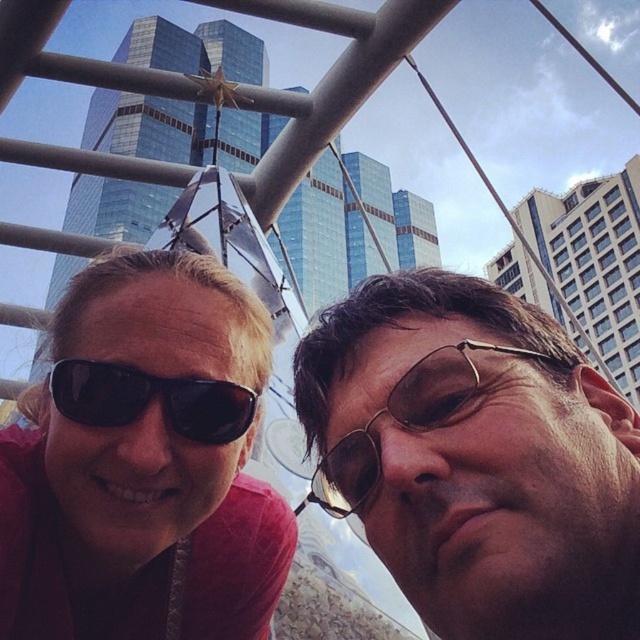
You are a photographer trying to capture a closeup shot of the metallic sunglasses at center and the black matte sunglasses at left. Which pair has a smaller width that might require you to adjust your camera focus for detail?

The metallic sunglasses at center has a lesser width compared to the black matte sunglasses at left, so it might require adjusting the camera focus for detail due to its smaller size.

You are taking a photo of two friends in front of a city skyline. You notice the metallic sunglasses at center and the metallic gold sunglasses at center. Which pair is positioned lower on their face?

The metallic sunglasses at center is located below metallic gold sunglasses at center, so the metallic sunglasses at center is positioned lower on their face.